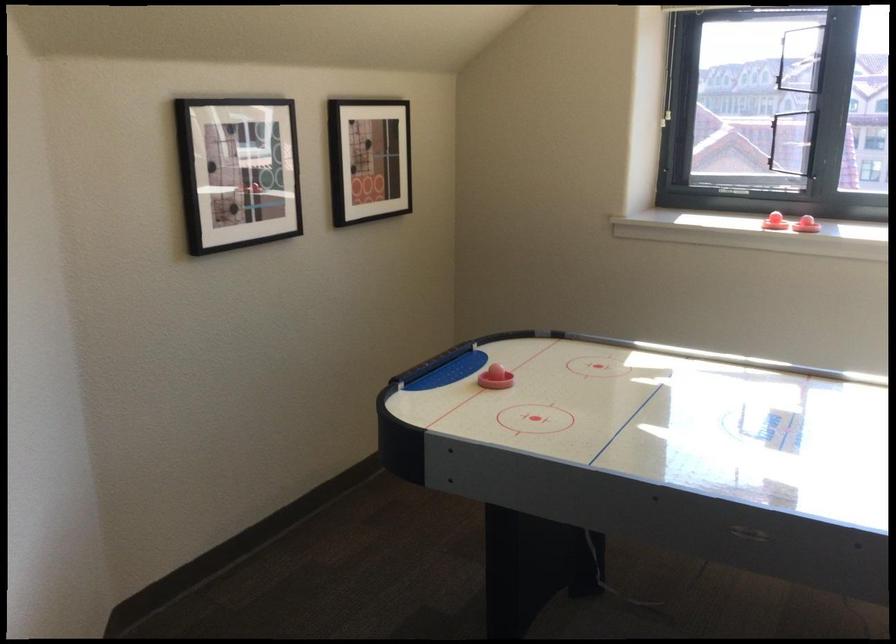
Describe the element at coordinates (669, 120) in the screenshot. The width and height of the screenshot is (896, 644). I see `the white blind pull cord` at that location.